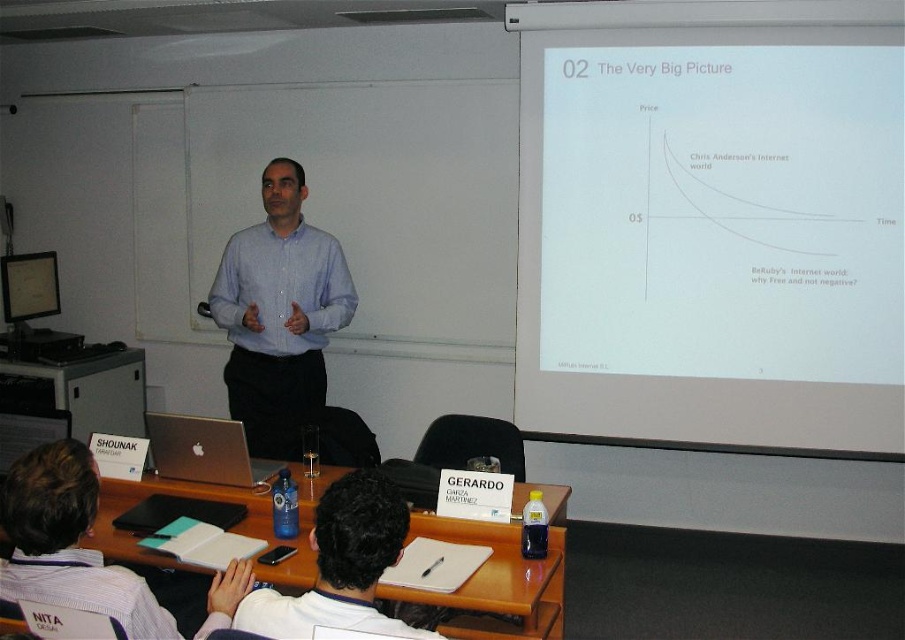
Does point (249, 337) come farther from viewer compared to point (355, 474)?

That is True.

Is point (272, 288) positioned before point (395, 560)?

No, (272, 288) is further to viewer.

In order to click on blue shirt at center in this screenshot , I will do `click(279, 316)`.

Is blue shirt at center below silver metallic laptop at center?

No.

Is blue shirt at center to the right of silver metallic laptop at center from the viewer's perspective?

Answer: Yes, blue shirt at center is to the right of silver metallic laptop at center.

Is point (286, 308) less distant than point (174, 451)?

No, it is behind (174, 451).

Where is `blue shirt at center`? This screenshot has height=640, width=905. blue shirt at center is located at coordinates tap(279, 316).

Does blue shirt at center lie behind white shirt at lower left?

Yes, it is.

Who is higher up, blue shirt at center or white shirt at lower left?

Positioned higher is blue shirt at center.

Which is behind, point (292, 412) or point (46, 522)?

Point (292, 412)

Identify the location of blue shirt at center. The image size is (905, 640). (279, 316).